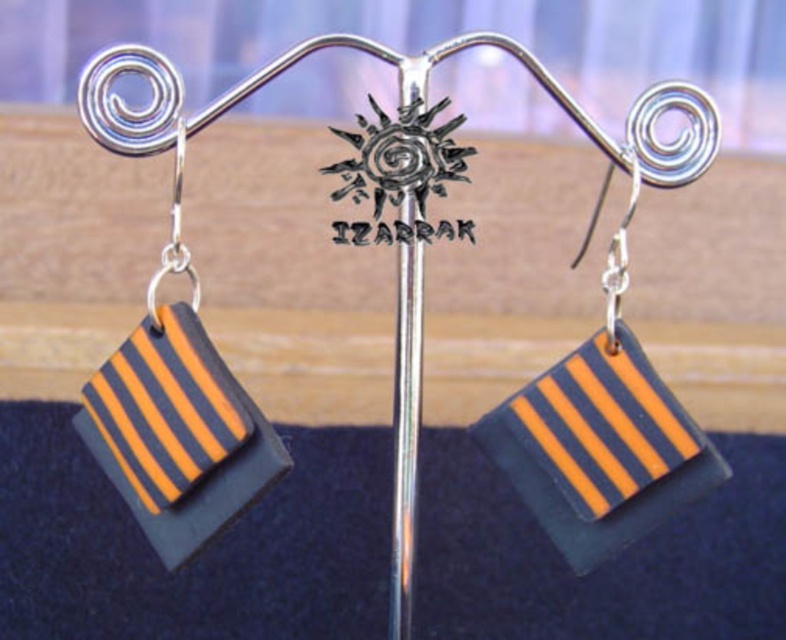
How much distance is there between orange matte rectangular earring at center and orange matte rectangular earring at left?

12.85 inches

Consider the image. Is orange matte rectangular earring at center bigger than orange matte rectangular earring at left?

Yes.

Who is more distant from viewer, (612,378) or (267,477)?

Positioned behind is point (612,378).

Identify the location of orange matte rectangular earring at center. This screenshot has width=786, height=640. (608, 403).